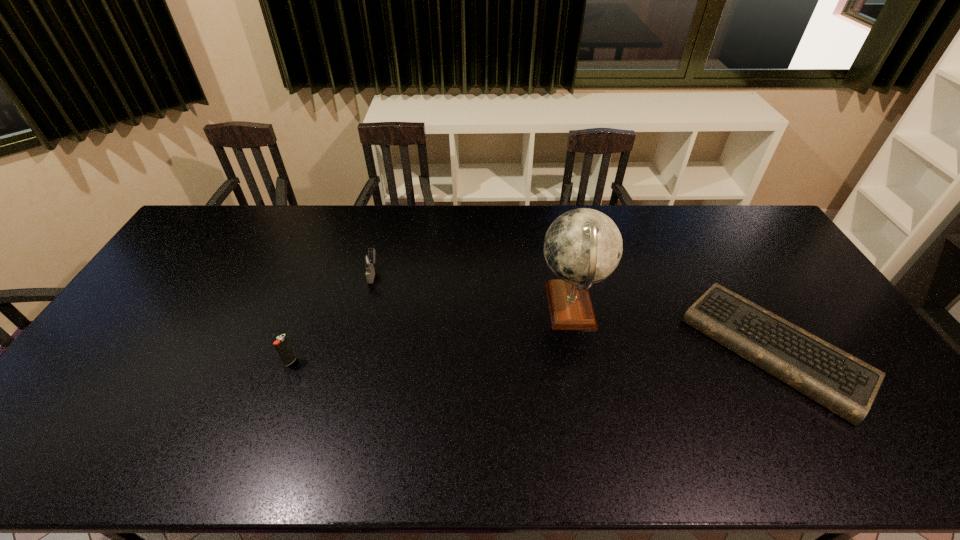
The image size is (960, 540). I want to click on free space located at the equator of the third object from left to right, so pos(461,307).

Find the location of `vacant region located on the back of the second object from left to right`. vacant region located on the back of the second object from left to right is located at coordinates (385, 227).

The width and height of the screenshot is (960, 540). What are the coordinates of `vacant space located on the front of the nearer igniter` in the screenshot? It's located at (259, 446).

In order to click on free spot located on the back of the rightmost object in this screenshot , I will do `click(731, 273)`.

You are a GUI agent. You are given a task and a screenshot of the screen. Output one action in this format:
    pyautogui.click(x=<x>, y=<y>)
    Task: Click on the object that is at the right edge
    
    Given the screenshot: What is the action you would take?
    pyautogui.click(x=847, y=386)

This screenshot has width=960, height=540. In order to click on free location at the far edge of the desktop in this screenshot , I will do `click(364, 242)`.

At what (x,y) coordinates should I click in order to perform the action: click on free space at the near edge. Please return your answer as a coordinate pair (x, y). The height and width of the screenshot is (540, 960). Looking at the image, I should click on (817, 443).

The width and height of the screenshot is (960, 540). I want to click on vacant area at the left edge, so click(x=153, y=282).

Locate an element on the screen. This screenshot has height=540, width=960. vacant space at the right edge of the desktop is located at coordinates pyautogui.click(x=777, y=259).

The width and height of the screenshot is (960, 540). Find the location of `vacant region between the third object from left to right and the right igniter`. vacant region between the third object from left to right and the right igniter is located at coordinates (472, 291).